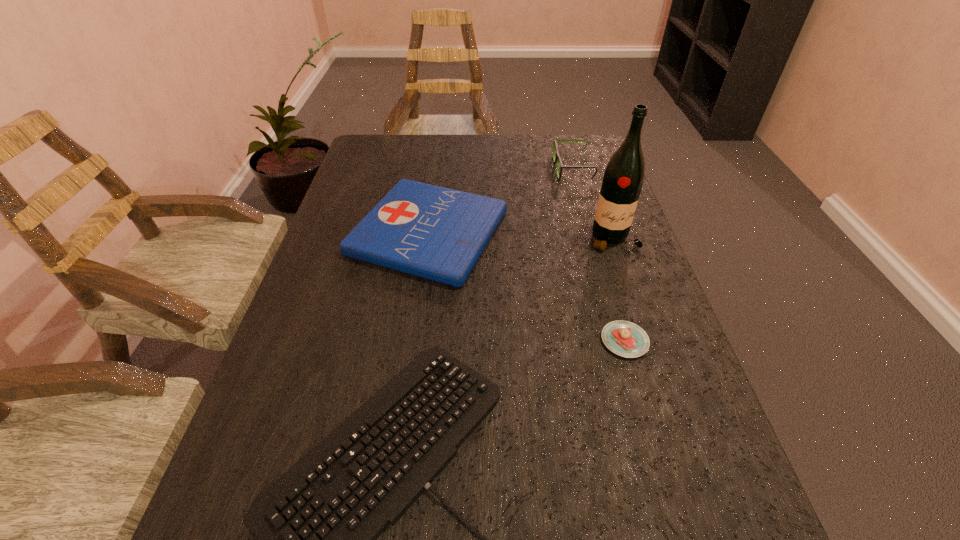
This screenshot has height=540, width=960. Find the location of `free location located 0.270m on the front of the pastry`. free location located 0.270m on the front of the pastry is located at coordinates (677, 518).

Image resolution: width=960 pixels, height=540 pixels. What are the coordinates of `object located at the far edge` in the screenshot? It's located at (557, 159).

I want to click on object at the left edge, so click(x=437, y=233).

This screenshot has width=960, height=540. I want to click on wine bottle at the right edge, so click(624, 174).

Image resolution: width=960 pixels, height=540 pixels. I want to click on spectacles that is at the right edge, so click(x=557, y=159).

This screenshot has width=960, height=540. In order to click on pastry present at the right edge in this screenshot , I will do `click(624, 338)`.

The width and height of the screenshot is (960, 540). Find the location of `object at the far right corner`. object at the far right corner is located at coordinates (557, 159).

The width and height of the screenshot is (960, 540). In order to click on vacant space at the far edge of the desktop in this screenshot , I will do click(x=505, y=134).

The width and height of the screenshot is (960, 540). In the image, there is a desktop. What are the coordinates of `vacant space at the left edge` in the screenshot? It's located at tap(336, 238).

The image size is (960, 540). Find the location of `free space at the right edge of the desktop`. free space at the right edge of the desktop is located at coordinates (694, 407).